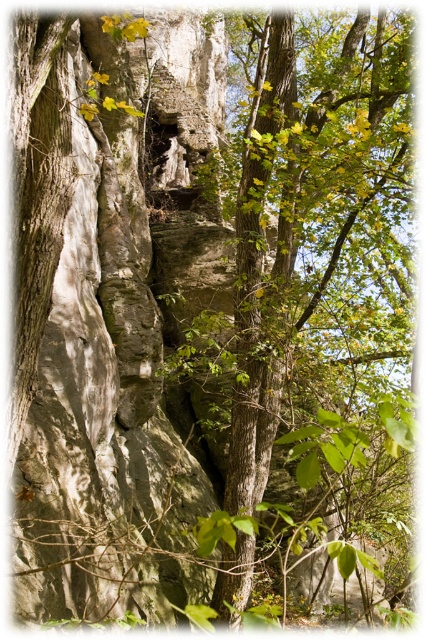
Is green leafy tree at center thinner than green rough bark tree trunk at center?

No.

Can you confirm if green leafy tree at center is wider than green rough bark tree trunk at center?

Yes, green leafy tree at center is wider than green rough bark tree trunk at center.

Identify the location of green leafy tree at center. The height and width of the screenshot is (640, 426). (316, 289).